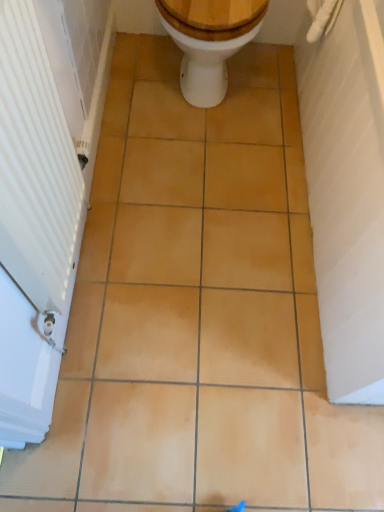
Question: Can you confirm if white glossy toilet at center is positioned to the right of white ribbed radiator at left?

Choices:
 (A) no
 (B) yes

Answer: (B)

Question: Is white glossy toilet at center located outside white ribbed radiator at left?

Choices:
 (A) no
 (B) yes

Answer: (B)

Question: Is white glossy toilet at center to the left of white ribbed radiator at left from the viewer's perspective?

Choices:
 (A) no
 (B) yes

Answer: (A)

Question: Is white glossy toilet at center positioned in front of white ribbed radiator at left?

Choices:
 (A) no
 (B) yes

Answer: (A)

Question: From the image's perspective, is white glossy toilet at center above white ribbed radiator at left?

Choices:
 (A) yes
 (B) no

Answer: (A)

Question: Does white glossy toilet at center have a larger size compared to white ribbed radiator at left?

Choices:
 (A) yes
 (B) no

Answer: (A)

Question: Is white ribbed radiator at left positioned behind white glossy toilet at center?

Choices:
 (A) no
 (B) yes

Answer: (A)

Question: From a real-world perspective, is white ribbed radiator at left over white glossy toilet at center?

Choices:
 (A) yes
 (B) no

Answer: (A)

Question: From a real-world perspective, is white ribbed radiator at left under white glossy toilet at center?

Choices:
 (A) no
 (B) yes

Answer: (A)

Question: From the image's perspective, is white ribbed radiator at left on white glossy toilet at center?

Choices:
 (A) no
 (B) yes

Answer: (A)

Question: From the image's perspective, would you say white ribbed radiator at left is shown under white glossy toilet at center?

Choices:
 (A) yes
 (B) no

Answer: (A)

Question: Can you confirm if white ribbed radiator at left is wider than white glossy toilet at center?

Choices:
 (A) yes
 (B) no

Answer: (B)

Question: Looking at their shapes, would you say white ribbed radiator at left is wider or thinner than white glossy toilet at center?

Choices:
 (A) wide
 (B) thin

Answer: (B)